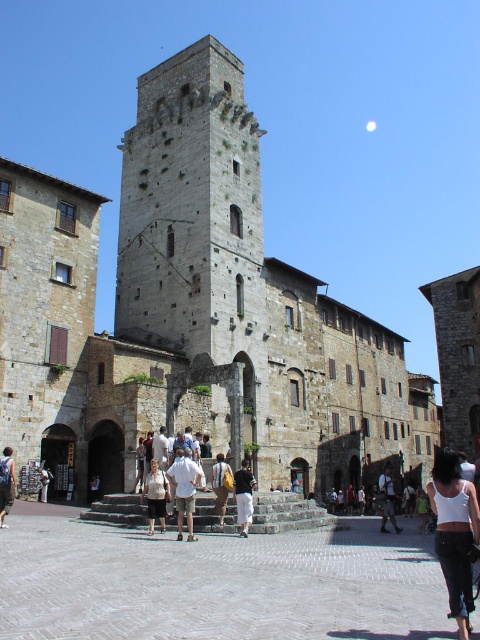
You are a tourist standing at the base of the historic stone tower and see the gray stone pavement at lower center and the matte white shirt at center. Which object is closer to your current position?

The gray stone pavement at lower center is closer to your current position because it is positioned under the matte white shirt at center, meaning the shirt is further away from you.

You are standing at the base of the historic stone tower in the town square. You notice a white cotton tank top at lower right. Where exactly is the white cotton tank top located in relation to the tower?

The white cotton tank top at lower right is located at point coordinates approximately 0.833 on the x axis and 0.948 on the y axis relative to the tower.